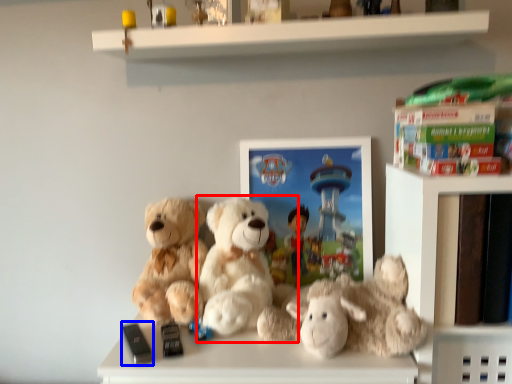
Question: Which object is closer to the camera taking this photo, teddy bear (highlighted by a red box) or toy (highlighted by a blue box)?

Choices:
 (A) teddy bear
 (B) toy

Answer: (B)